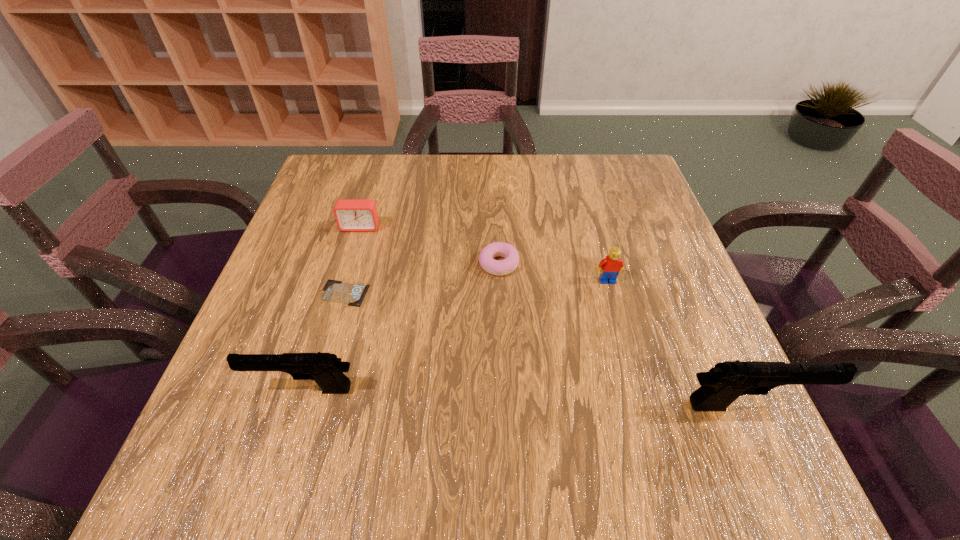
This screenshot has height=540, width=960. What are the coordinates of `empty space between the right pistol and the left pistol` in the screenshot? It's located at (526, 397).

The height and width of the screenshot is (540, 960). What are the coordinates of `vacant area between the second object from right to left and the left pistol` in the screenshot? It's located at tap(456, 335).

The height and width of the screenshot is (540, 960). Find the location of `vacant area that lies between the rightmost object and the identity card`. vacant area that lies between the rightmost object and the identity card is located at coordinates (546, 349).

Find the location of `vacant area between the nearest object and the pastry`. vacant area between the nearest object and the pastry is located at coordinates (623, 335).

Where is `free space between the second object from right to left and the fifth tallest object`? This screenshot has height=540, width=960. free space between the second object from right to left and the fifth tallest object is located at coordinates (553, 272).

Where is `free space between the identity card and the Lego`? The height and width of the screenshot is (540, 960). free space between the identity card and the Lego is located at coordinates (476, 287).

Locate an element on the screen. unoccupied area between the shortest object and the right pistol is located at coordinates (546, 349).

You are a GUI agent. You are given a task and a screenshot of the screen. Output one action in this format:
    pyautogui.click(x=<x>, y=<y>)
    Task: Click on the unoccupied area between the tallest object and the farther pistol
    The height and width of the screenshot is (540, 960).
    Given the screenshot: What is the action you would take?
    (526, 397)

The image size is (960, 540). I want to click on the fourth closest object to the nearest object, so click(x=335, y=291).

The image size is (960, 540). Identify the location of the fourth closest object to the nearest object. (335, 291).